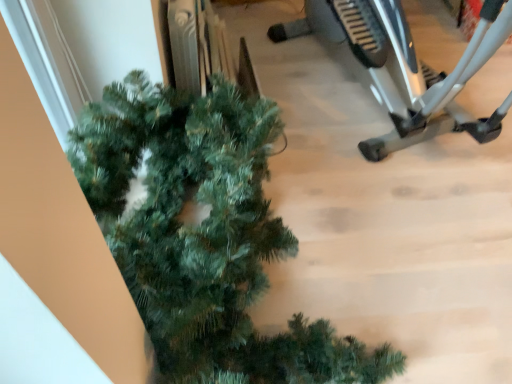
The height and width of the screenshot is (384, 512). I want to click on spots to the right of green matte christmas tree at lower left, so click(432, 267).